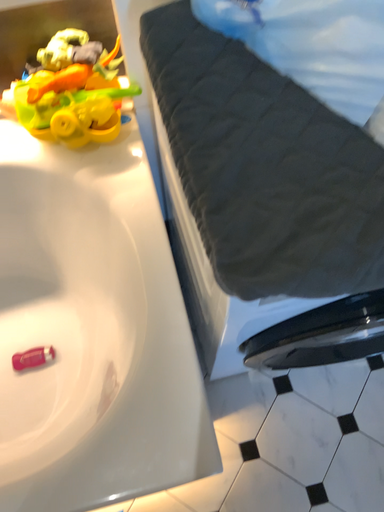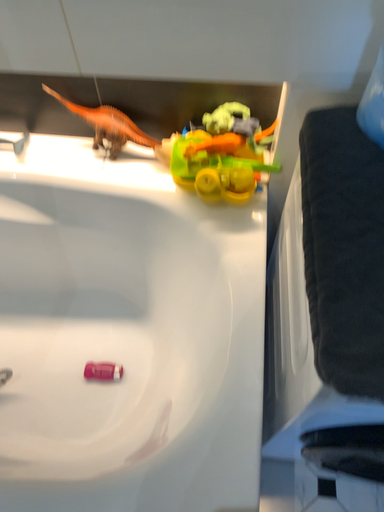
Question: Which way did the camera rotate in the video?

Choices:
 (A) rotated downward
 (B) rotated upward

Answer: (B)